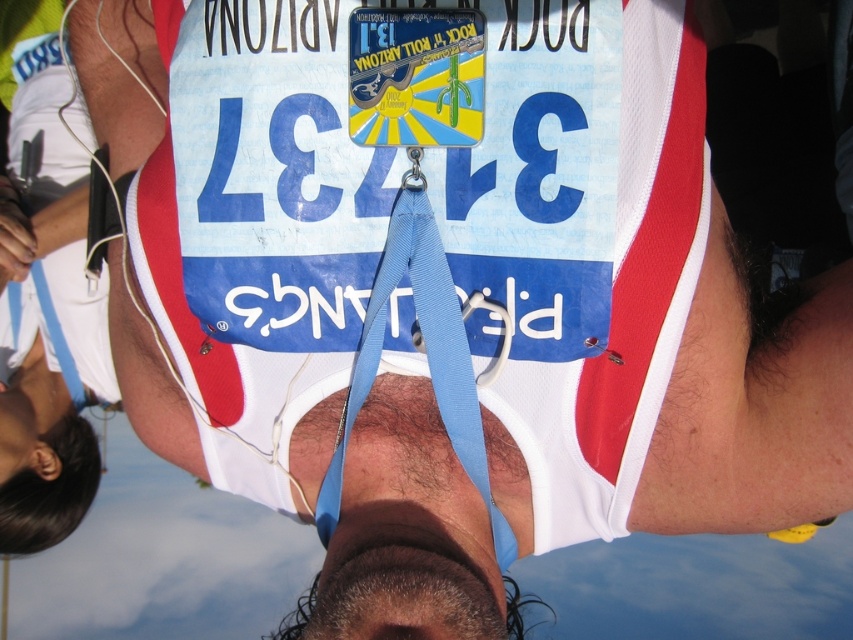
Locate an element on the screen. blue fabric strap at center is located at coordinates (425, 355).

Find the location of a particular element. blue fabric strap at center is located at coordinates (425, 355).